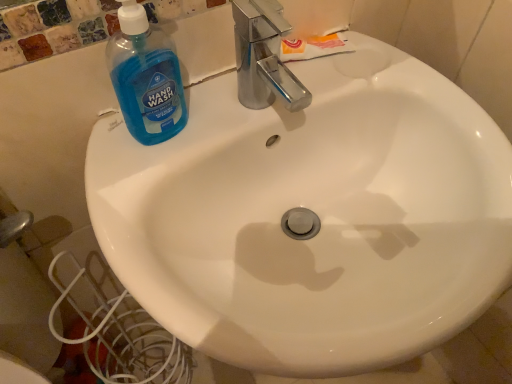
I want to click on blue translucent liquid hand wash at upper left, so click(x=146, y=77).

Measure the distance between point (173, 107) and camera.

A distance of 21.65 inches exists between point (173, 107) and camera.

Describe the element at coordinates (146, 77) in the screenshot. I see `blue translucent liquid hand wash at upper left` at that location.

The image size is (512, 384). Identify the location of blue translucent liquid hand wash at upper left. (146, 77).